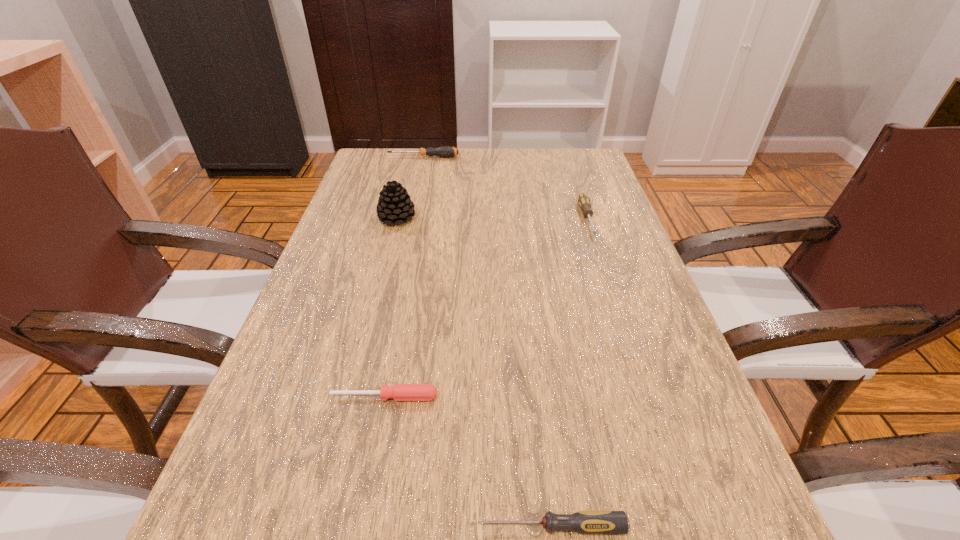
Where is `vacant position in the image that satisfies the following two spatial constraints: 1. at the tip of the rightmost screwdriver; 2. insert the second screwdriver from right to left into a screw head`? Image resolution: width=960 pixels, height=540 pixels. vacant position in the image that satisfies the following two spatial constraints: 1. at the tip of the rightmost screwdriver; 2. insert the second screwdriver from right to left into a screw head is located at coordinates (688, 526).